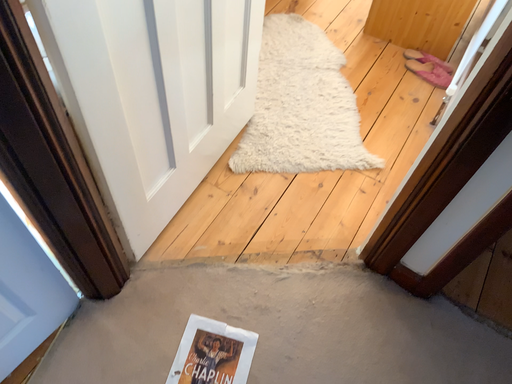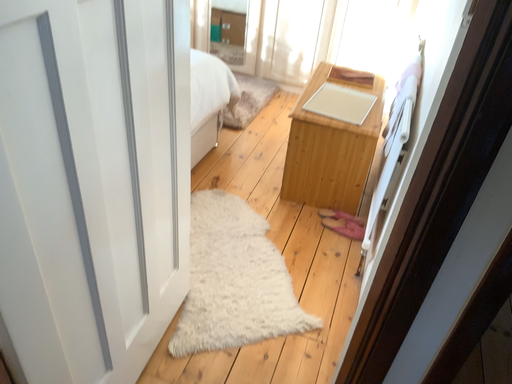
Question: How did the camera likely rotate when shooting the video?

Choices:
 (A) rotated upward
 (B) rotated downward

Answer: (A)